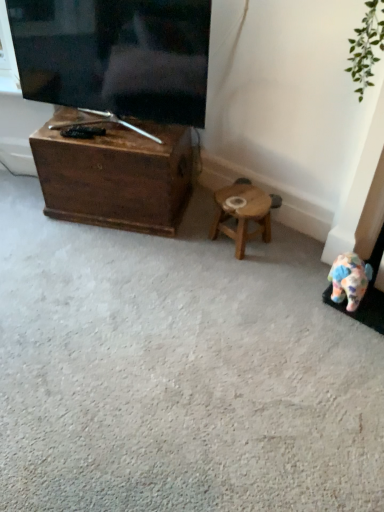
The height and width of the screenshot is (512, 384). Find the location of `empty space that is ontop of wooden stool at center (from a real-world perspective)`. empty space that is ontop of wooden stool at center (from a real-world perspective) is located at coordinates (247, 199).